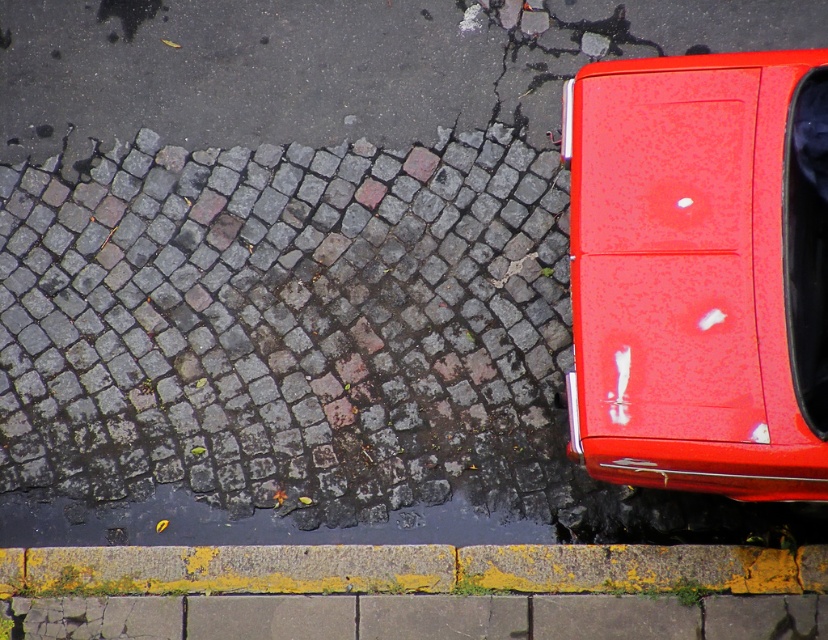
In the scene shown: You are a delivery drone flying above a cobblestone street. You need to land on the glossy red car at lower right. What are the coordinates where you should aim to land?

The glossy red car at lower right is located at point (x=696, y=275), so you should aim for those coordinates to land safely.

You are a delivery person trying to park your glossy red car at lower right as close as possible to the yellow painted concrete curb at lower center without going over the curb. What is the closest distance you can park the car to the curb?

The closest distance you can park the glossy red car at lower right to the yellow painted concrete curb at lower center is 1.62 meters, as that is the minimum distance between them according to the scene description.

You are standing at the center of the street looking towards the red car at lower right. There is a point marked at coordinates (696, 275). What object is located at that point?

The glossy red car at lower right is located at point (696, 275).